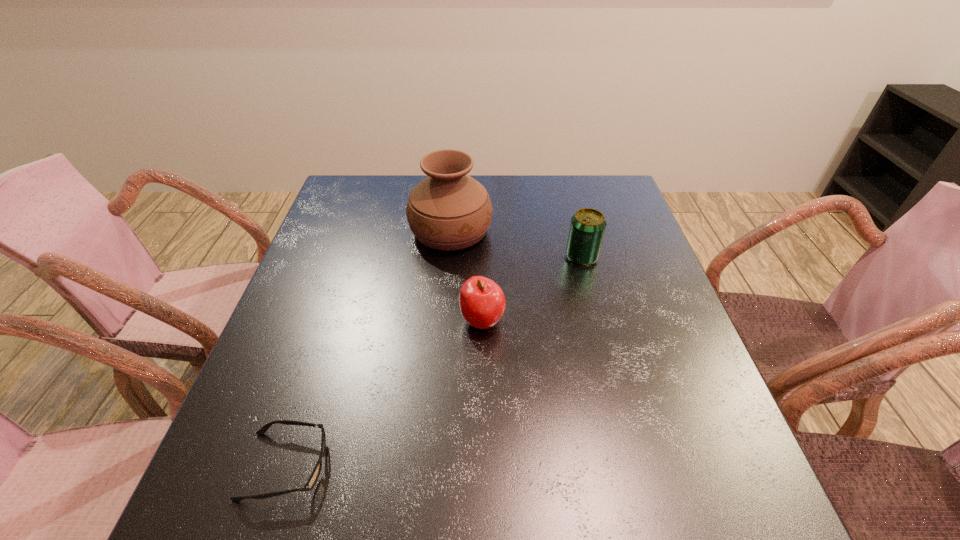
Identify the location of urn. (449, 210).

Image resolution: width=960 pixels, height=540 pixels. I want to click on beer can, so click(587, 228).

I want to click on apple, so click(x=482, y=303).

Image resolution: width=960 pixels, height=540 pixels. What are the coordinates of `the leftmost object` in the screenshot? It's located at (314, 476).

Locate an element on the screen. This screenshot has width=960, height=540. the shortest object is located at coordinates (314, 476).

Where is `vacant region located on the back of the urn`? vacant region located on the back of the urn is located at coordinates click(454, 192).

In order to click on vacant area situated 0.300m on the left of the rightmost object in this screenshot , I will do `click(448, 257)`.

Where is `vacant space situated on the left of the apple`? The width and height of the screenshot is (960, 540). vacant space situated on the left of the apple is located at coordinates (318, 321).

Where is `free space located 0.120m on the front-facing side of the shortest object`? free space located 0.120m on the front-facing side of the shortest object is located at coordinates (398, 465).

Where is `object located in the far edge section of the desktop`? The image size is (960, 540). object located in the far edge section of the desktop is located at coordinates (449, 210).